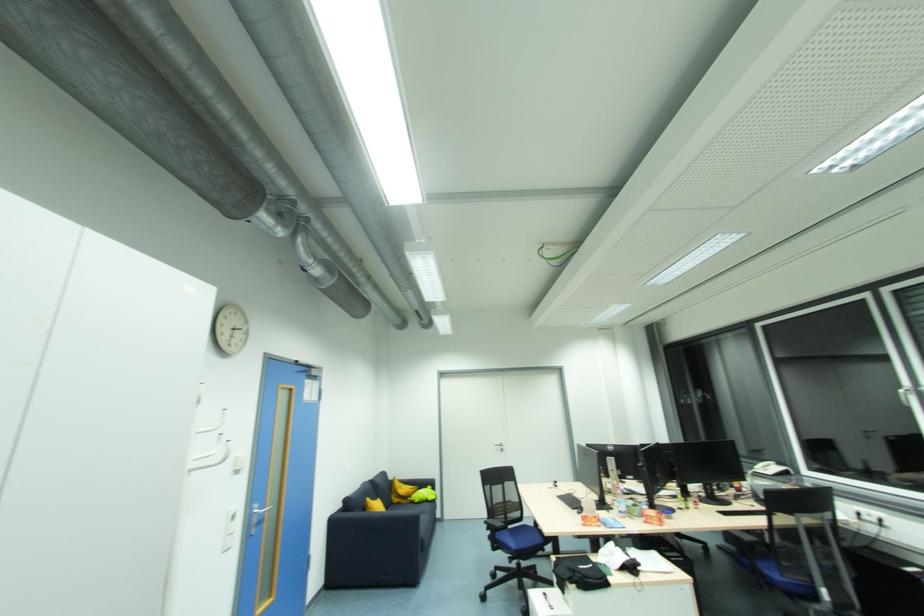
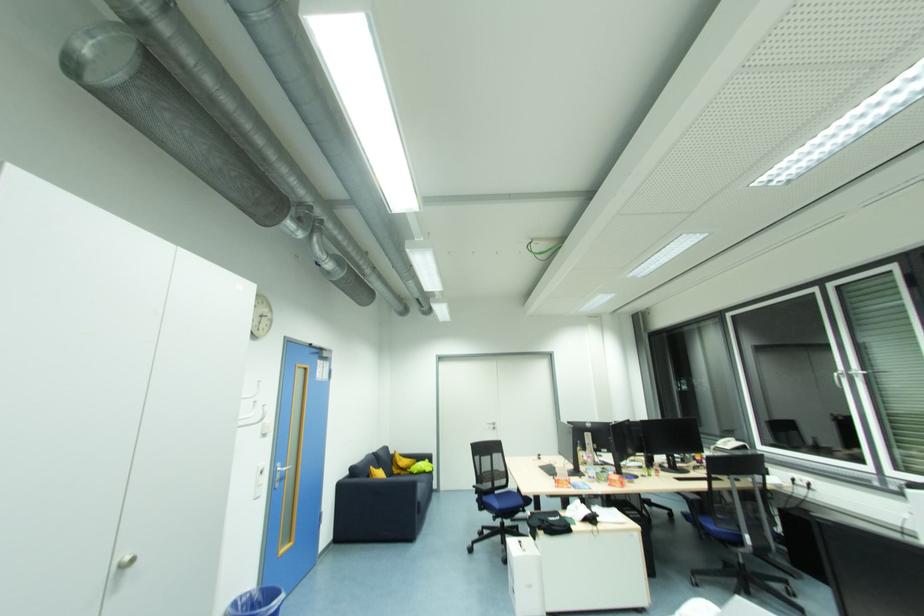
Question: The images are taken continuously from a first-person perspective. In which direction are you moving?

Choices:
 (A) Left
 (B) Right
 (C) Forward
 (D) Backward

Answer: (D)